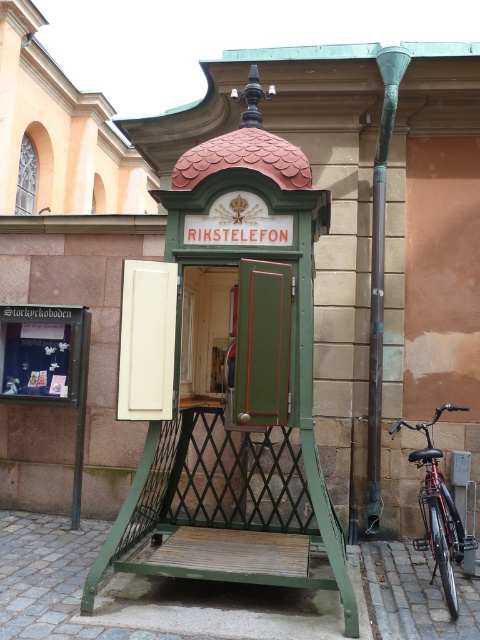
Question: Can you confirm if green wood telephone booth at center is positioned below green patinated metal pole at right?

Choices:
 (A) no
 (B) yes

Answer: (B)

Question: Does green wood telephone booth at center appear on the right side of green patinated metal pole at right?

Choices:
 (A) no
 (B) yes

Answer: (A)

Question: Which point is farther to the camera?

Choices:
 (A) green patinated metal pole at right
 (B) shiny black bicycle at lower right
 (C) green wood telephone booth at center

Answer: (A)

Question: Which object appears closest to the camera in this image?

Choices:
 (A) green wood telephone booth at center
 (B) shiny black bicycle at lower right
 (C) green patinated metal pole at right

Answer: (A)

Question: Is green patinated metal pole at right thinner than shiny black bicycle at lower right?

Choices:
 (A) yes
 (B) no

Answer: (A)

Question: Which object is closer to the camera taking this photo?

Choices:
 (A) green wood telephone booth at center
 (B) green patinated metal pole at right

Answer: (A)